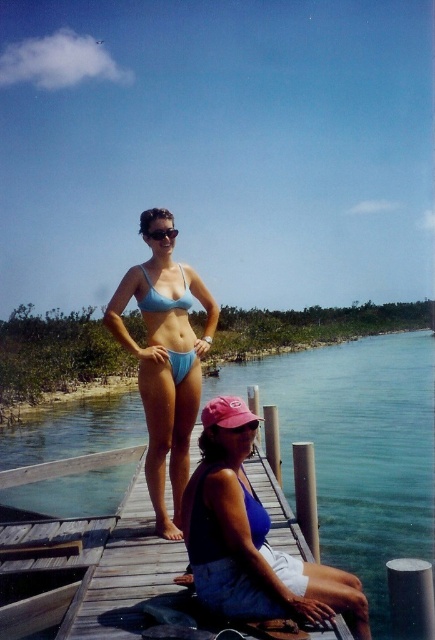
Which is above, blue fabric bikini bottom at lower center or light blue fabric bikini at center?

light blue fabric bikini at center is above.

Who is more forward, (284, 588) or (187, 285)?

Positioned in front is point (284, 588).

Locate an element on the screen. This screenshot has height=640, width=435. blue fabric bikini bottom at lower center is located at coordinates (250, 538).

The height and width of the screenshot is (640, 435). I want to click on blue fabric bikini bottom at lower center, so click(x=250, y=538).

Is blue fabric bikini bottom at lower center shorter than matte blue bikini at center?

Indeed, blue fabric bikini bottom at lower center has a lesser height compared to matte blue bikini at center.

The height and width of the screenshot is (640, 435). In order to click on blue fabric bikini bottom at lower center in this screenshot , I will do `click(250, 538)`.

The height and width of the screenshot is (640, 435). Describe the element at coordinates (358, 445) in the screenshot. I see `clear blue water at center` at that location.

Does clear blue water at center have a smaller size compared to light blue fabric bikini top at center?

Incorrect, clear blue water at center is not smaller in size than light blue fabric bikini top at center.

Measure the distance between clear blue water at center and camera.

clear blue water at center is 14.27 feet from camera.

Where is `clear blue water at center`? The height and width of the screenshot is (640, 435). clear blue water at center is located at coordinates (358, 445).